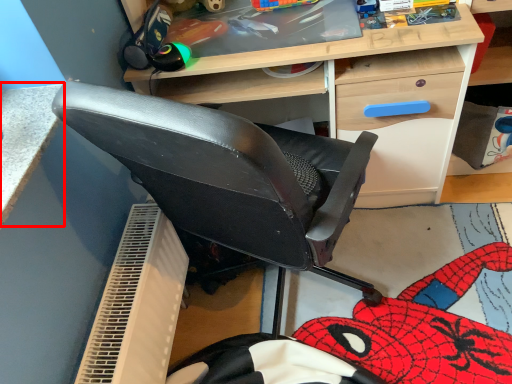
Question: From the image's perspective, considering the relative positions of table (annotated by the red box) and desk in the image provided, where is table (annotated by the red box) located with respect to the staircase?

Choices:
 (A) above
 (B) below

Answer: (B)